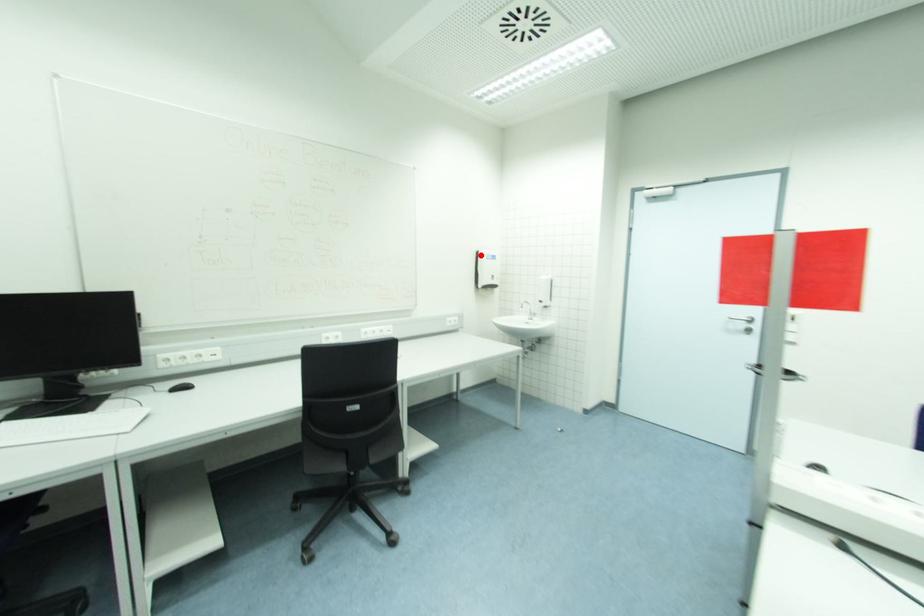
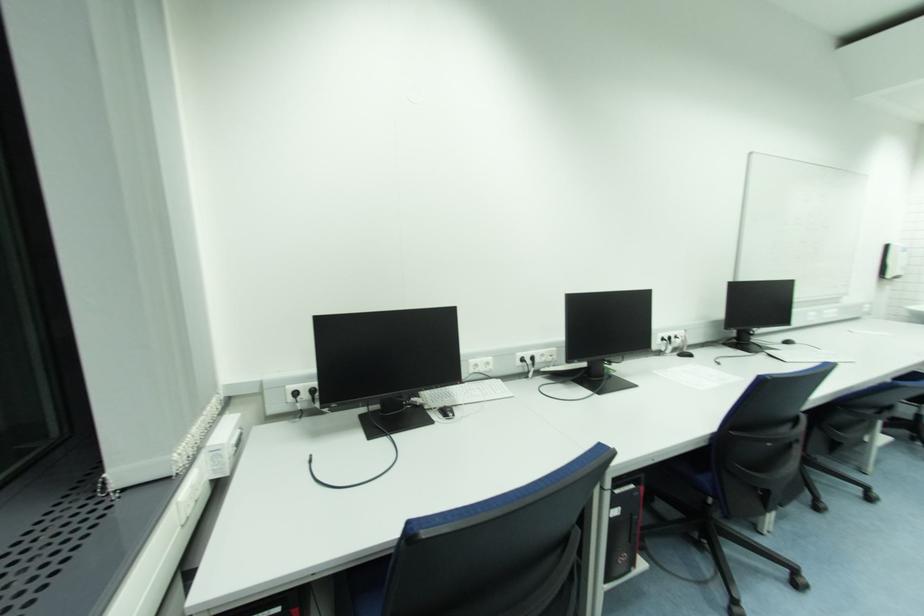
Find the pixel in the second image that matches the highlighted location in the first image.

(892, 248)